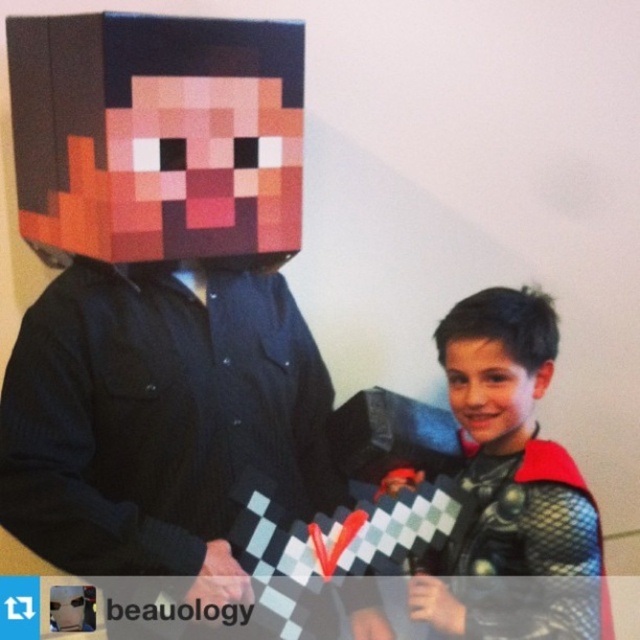
Does matte black costume at center have a larger size compared to dark brown hair at center?

Indeed, matte black costume at center has a larger size compared to dark brown hair at center.

Who is taller, matte black costume at center or dark brown hair at center?

Standing taller between the two is matte black costume at center.

Which is in front, point (518, 552) or point (481, 333)?

Point (518, 552) is in front.

I want to click on matte black costume at center, so click(508, 458).

Which is above, dark brown hair at center or smooth skin face at center?

dark brown hair at center is higher up.

Who is more forward, (554, 346) or (513, 413)?

Point (513, 413)

Is point (472, 340) closer to camera compared to point (477, 404)?

That is False.

Identify the location of dark brown hair at center. This screenshot has width=640, height=640. (497, 364).

Measure the distance between matte black costume at center and smooth skin face at center.

matte black costume at center is 2.79 inches from smooth skin face at center.

Can you confirm if matte black costume at center is positioned above smooth skin face at center?

Actually, matte black costume at center is below smooth skin face at center.

Who is more forward, (529, 300) or (467, 429)?

Point (529, 300)

Where is `matte black costume at center`? The width and height of the screenshot is (640, 640). matte black costume at center is located at coordinates (508, 458).